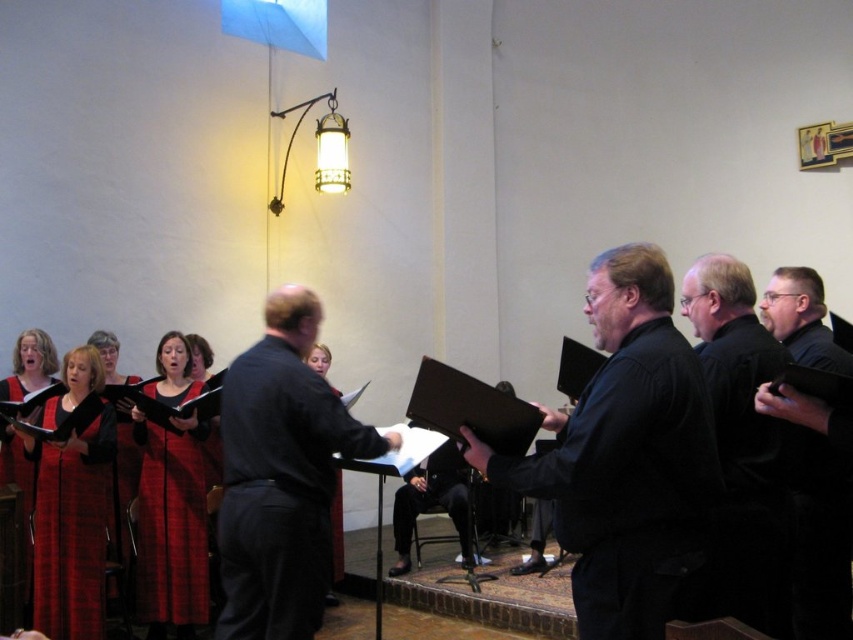
Question: Which point is farther from the camera taking this photo?

Choices:
 (A) (659, 456)
 (B) (103, 582)
 (C) (158, 435)

Answer: (C)

Question: Which of the following is the farthest from the observer?

Choices:
 (A) (341, 429)
 (B) (54, 412)
 (C) (167, 401)
 (D) (581, 532)

Answer: (C)

Question: Is dark blue shirt at center above black matte book at right?

Choices:
 (A) no
 (B) yes

Answer: (A)

Question: From the image, what is the correct spatial relationship of dark blue shirt at center in relation to black matte suit at right?

Choices:
 (A) below
 (B) above

Answer: (A)

Question: Does black matte suit at center appear under red plaid dress at center?

Choices:
 (A) no
 (B) yes

Answer: (A)

Question: Estimate the real-world distances between objects in this image. Which object is closer to the dark blue shirt at center?

Choices:
 (A) plaid wool dress at lower left
 (B) black matte suit at right
 (C) black matte suit at center
 (D) black matte book at right

Answer: (C)